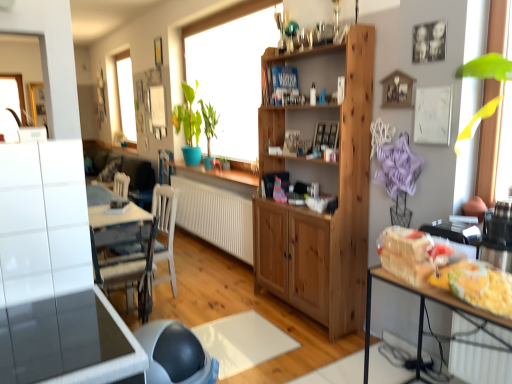
Question: Is translucent plastic bag at right, which appears as the first food when viewed from the top, closer to the viewer compared to wooden window frame at center?

Choices:
 (A) no
 (B) yes

Answer: (B)

Question: Considering the relative sizes of translucent plastic bag at right, which appears as the first food when viewed from the top, and wooden window frame at center in the image provided, is translucent plastic bag at right, which appears as the first food when viewed from the top, taller than wooden window frame at center?

Choices:
 (A) yes
 (B) no

Answer: (B)

Question: Is translucent plastic bag at right, marked as the second food in a bottom-to-top arrangement, behind wooden window frame at center?

Choices:
 (A) yes
 (B) no

Answer: (B)

Question: Considering the relative sizes of translucent plastic bag at right, which appears as the first food when viewed from the top, and wooden window frame at center in the image provided, is translucent plastic bag at right, which appears as the first food when viewed from the top, smaller than wooden window frame at center?

Choices:
 (A) no
 (B) yes

Answer: (B)

Question: Is translucent plastic bag at right, which appears as the first food when viewed from the top, positioned beyond the bounds of wooden window frame at center?

Choices:
 (A) no
 (B) yes

Answer: (B)

Question: Are translucent plastic bag at right, which appears as the first food when viewed from the top, and wooden window frame at center making contact?

Choices:
 (A) no
 (B) yes

Answer: (A)

Question: Is glossy white table at lower left, the second table viewed from the back, wider than translucent plastic bag at right, marked as the second food in a bottom-to-top arrangement?

Choices:
 (A) no
 (B) yes

Answer: (B)

Question: Does glossy white table at lower left, the first table viewed from the front, appear on the right side of translucent plastic bag at right, marked as the second food in a bottom-to-top arrangement?

Choices:
 (A) no
 (B) yes

Answer: (A)

Question: Is glossy white table at lower left, the second table from the right, closer to camera compared to translucent plastic bag at right, which appears as the first food when viewed from the top?

Choices:
 (A) no
 (B) yes

Answer: (B)

Question: Does glossy white table at lower left, positioned as the 1th table in left-to-right order, have a lesser height compared to translucent plastic bag at right, marked as the second food in a bottom-to-top arrangement?

Choices:
 (A) yes
 (B) no

Answer: (A)

Question: From the image's perspective, would you say glossy white table at lower left, the second table viewed from the back, is positioned over translucent plastic bag at right, marked as the second food in a bottom-to-top arrangement?

Choices:
 (A) no
 (B) yes

Answer: (A)

Question: Is glossy white table at lower left, the second table viewed from the back, smaller than translucent plastic bag at right, marked as the second food in a bottom-to-top arrangement?

Choices:
 (A) no
 (B) yes

Answer: (A)

Question: Is white textured radiator at center aimed at wooden table at right, arranged as the second table when viewed from the left?

Choices:
 (A) yes
 (B) no

Answer: (B)